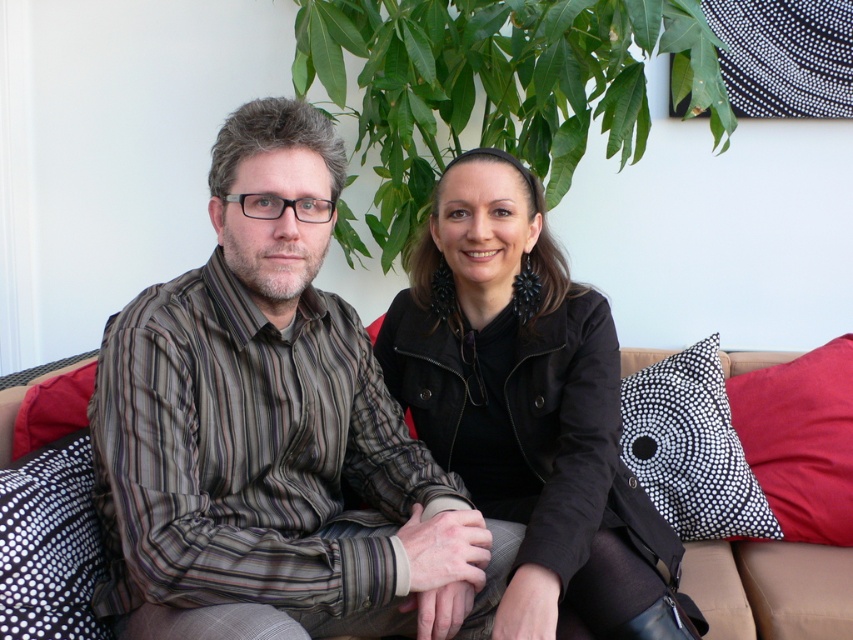
You are designing a layout for a magazine spread and need to know the relative sizes of the striped cotton shirt at center and the black dotted pillow at lower left. Which object is taller?

The striped cotton shirt at center is taller than the black dotted pillow at lower left according to the description.

You are a furniture designer evaluating the space for a new sofa. The beige fabric couch at center and black dotted pillow at lower left are currently in the room. Which object takes up more space?

The beige fabric couch at center is larger in size than the black dotted pillow at lower left, so it takes up more space.

From the picture: You are a tailor measuring the distance between two items in the image. You need to determine if a 12 inch ruler can accurately measure the space between the striped cotton shirt at center and the black dotted pillow at lower left. Can the ruler fit the space?

The distance between the striped cotton shirt at center and the black dotted pillow at lower left is 11.71 inches, which is slightly less than 12 inches. The ruler can fit the space since it is shorter than the ruler length.